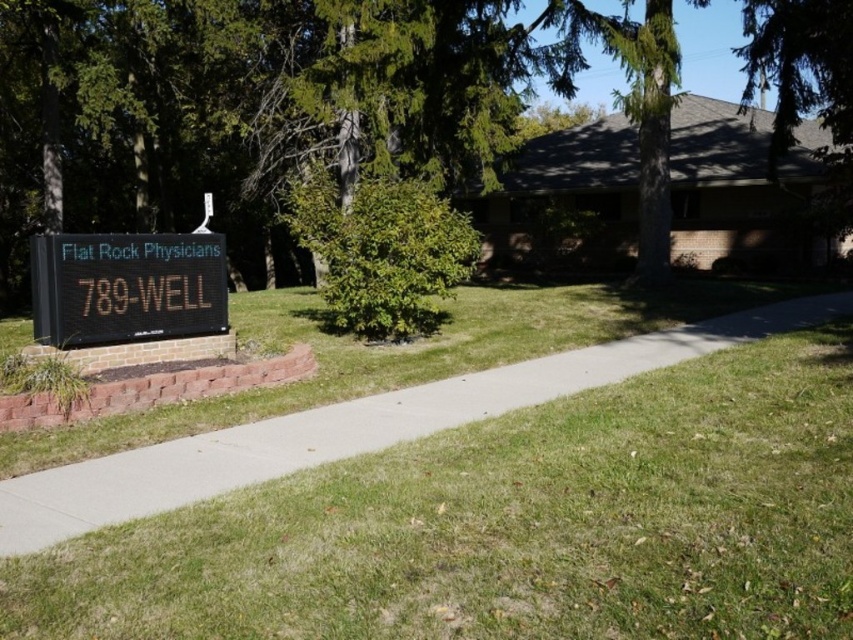
Question: Can you confirm if green leafy tree at center is smaller than concrete at left?

Choices:
 (A) yes
 (B) no

Answer: (B)

Question: Can you confirm if green leafy tree at center is positioned to the left of black digital sign at lower left?

Choices:
 (A) no
 (B) yes

Answer: (A)

Question: Which point appears closest to the camera in this image?

Choices:
 (A) (181, 252)
 (B) (73, 20)

Answer: (A)

Question: Which of the following is the farthest from the observer?

Choices:
 (A) (196, 236)
 (B) (824, 314)

Answer: (B)

Question: Estimate the real-world distances between objects in this image. Which object is farther from the black digital sign at lower left?

Choices:
 (A) concrete at left
 (B) green leafy tree at center

Answer: (B)

Question: Observing the image, what is the correct spatial positioning of green leafy tree at center in reference to black digital sign at lower left?

Choices:
 (A) left
 (B) right

Answer: (B)